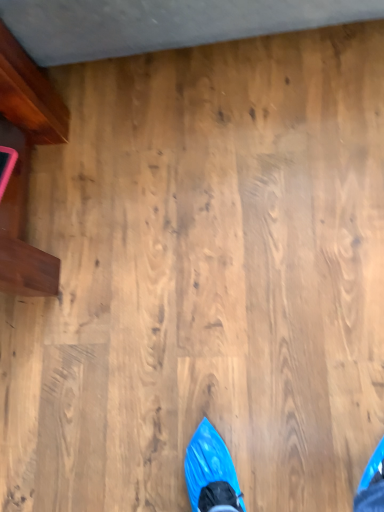
The height and width of the screenshot is (512, 384). What are the coordinates of `free region under wooden desk at left (from a real-world perspective)` in the screenshot? It's located at (41, 199).